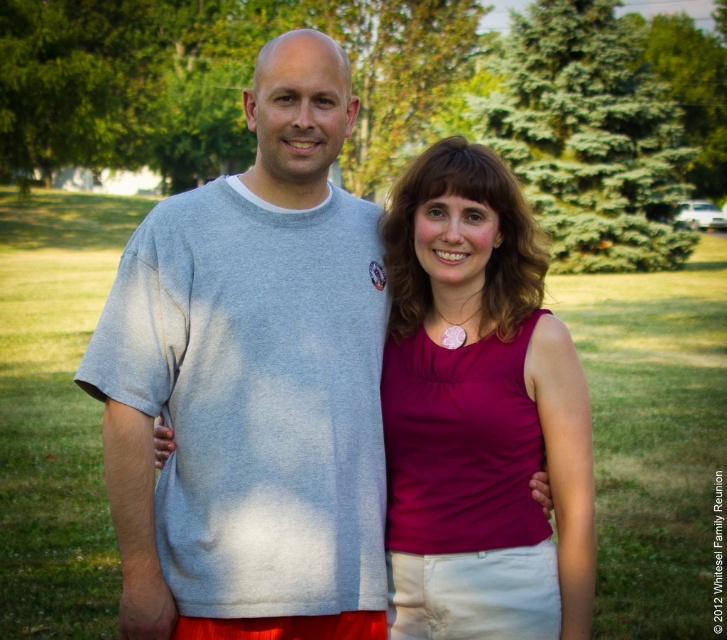
Consider the image. You are a photographer trying to capture a closeup of the matte pink fabric at center without the green leafy tree at upper center appearing in the background. Based on the scene description, can you position yourself in a way to achieve this?

The matte pink fabric at center is in front of the green leafy tree at upper center, so you can position yourself closer to the matte pink fabric at center and angle your camera downward to avoid capturing the green leafy tree at upper center in the background.

You are standing at the origin of a coordinate system placed at the bottom left corner of the image. You see a point at coordinates [478,413]. What object is located at that point?

The point at coordinates [478,413] is occupied by the matte pink fabric at center.

You are planning to take a photo of the matte pink fabric at center and the green leafy tree at upper center. Which object takes up more space in the image?

The green leafy tree at upper center takes up more space in the image than the matte pink fabric at center because the matte pink fabric at center occupies less space than green leafy tree at upper center.